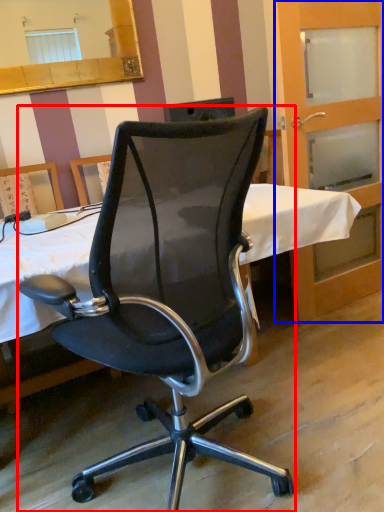
Question: Which point is further to the camera, chair (highlighted by a red box) or screen door (highlighted by a blue box)?

Choices:
 (A) chair
 (B) screen door

Answer: (B)